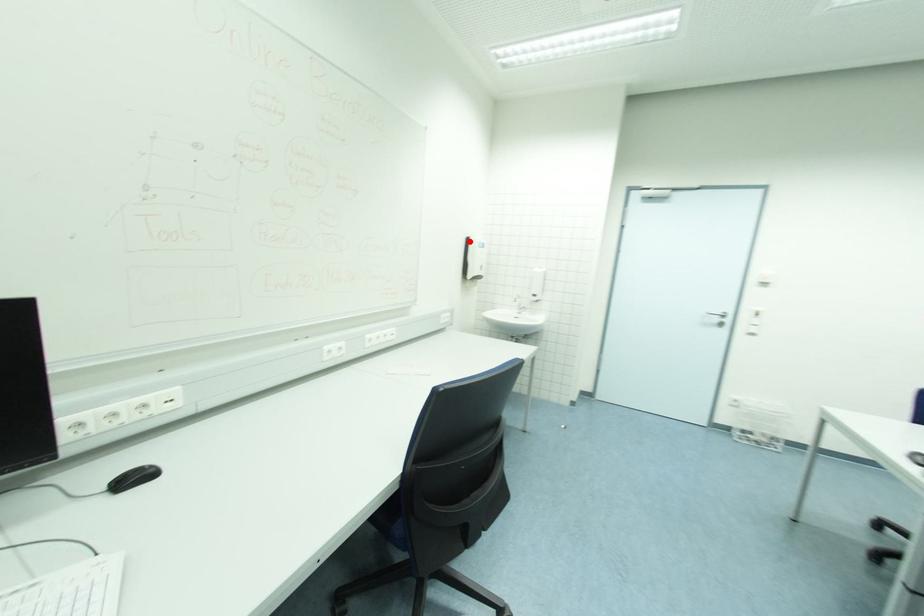
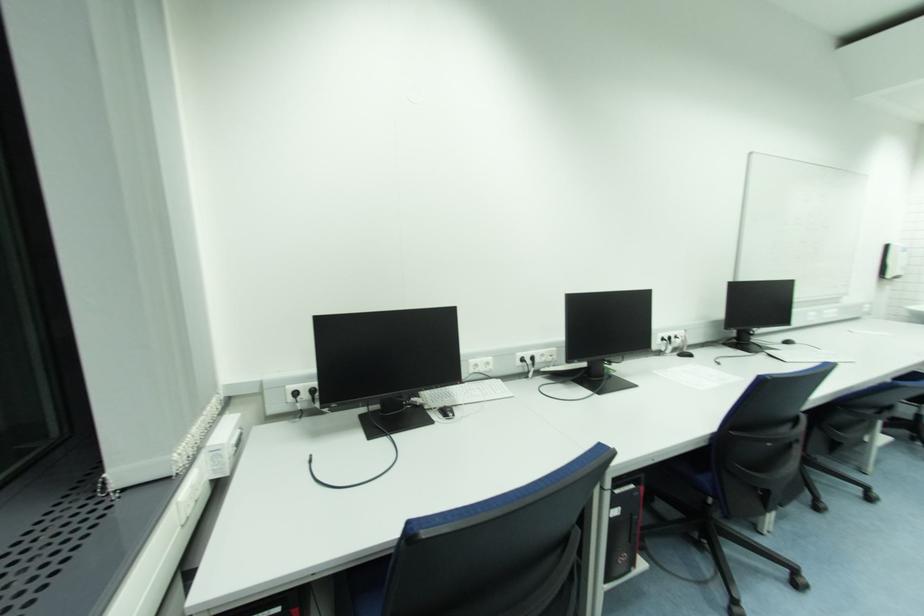
Locate, in the second image, the point that corresponds to the highlighted location in the first image.

(892, 248)